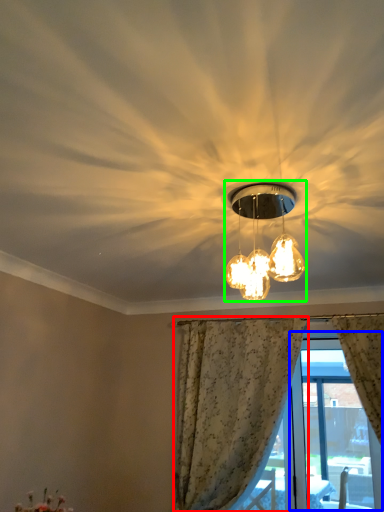
Question: Based on their relative distances, which object is farther from curtain (highlighted by a red box)? Choose from window screen (highlighted by a blue box) and lamp (highlighted by a green box).

Choices:
 (A) window screen
 (B) lamp

Answer: (B)